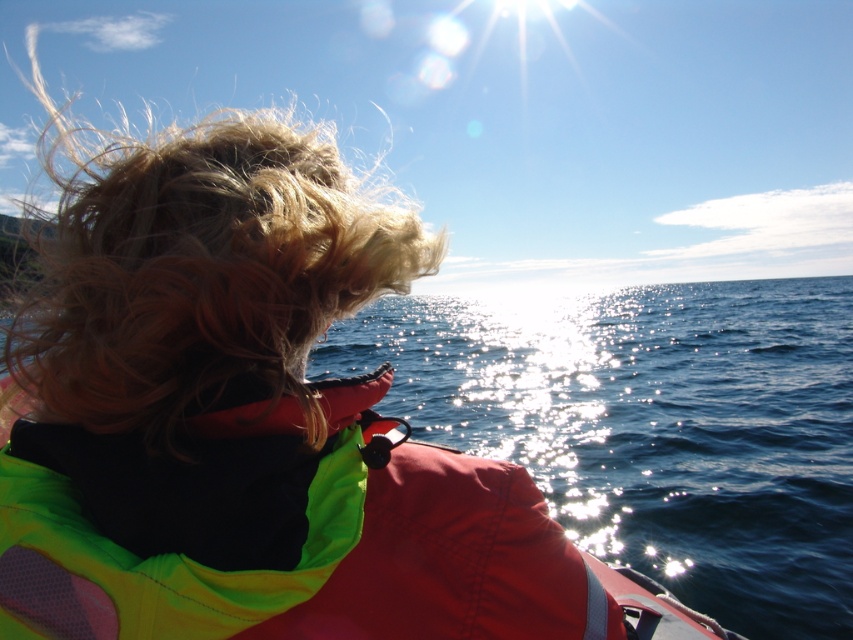
You are on a boat and want to check your hair in the water reflection. Since the water surface is at point (199, 272), where should you look to see your hair reflected?

The blonde hair at upper left is located at point (199, 272), so you should look at that point to see its reflection in the water.

Consider the image. You are on a boat looking at the sea. There are two points marked on the water surface. The first point is at coordinates point (714, 461) and the second point is at point (346, 504). Which point is closer to you?

Point (714, 461) is further to the camera than point (346, 504), so the point closer to you is point (346, 504).